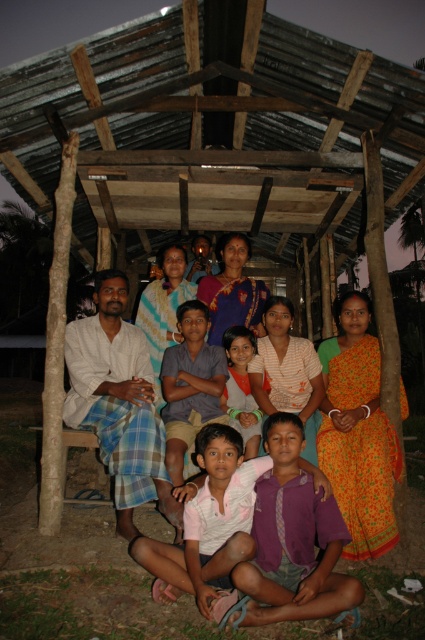
What do you see at coordinates (354, 493) in the screenshot? The image size is (425, 640). I see `multicolored fabric dress at center` at bounding box center [354, 493].

Between point (391, 493) and point (251, 400), which one is positioned behind?

Positioned behind is point (251, 400).

Describe the element at coordinates (354, 493) in the screenshot. This screenshot has height=640, width=425. I see `multicolored fabric dress at center` at that location.

The width and height of the screenshot is (425, 640). I want to click on multicolored fabric dress at center, so click(x=354, y=493).

Is white cotton kurta at left to the right of multicolored fabric dress at center from the viewer's perspective?

Incorrect, white cotton kurta at left is not on the right side of multicolored fabric dress at center.

This screenshot has height=640, width=425. What do you see at coordinates (119, 403) in the screenshot?
I see `white cotton kurta at left` at bounding box center [119, 403].

Who is more distant from viewer, (82, 364) or (348, 481)?

Positioned behind is point (82, 364).

I want to click on white cotton kurta at left, so click(x=119, y=403).

Is pink fabric shirt at lower center thinner than orange cotton shirt at center?

No, pink fabric shirt at lower center is not thinner than orange cotton shirt at center.

This screenshot has height=640, width=425. I want to click on pink fabric shirt at lower center, so click(x=201, y=520).